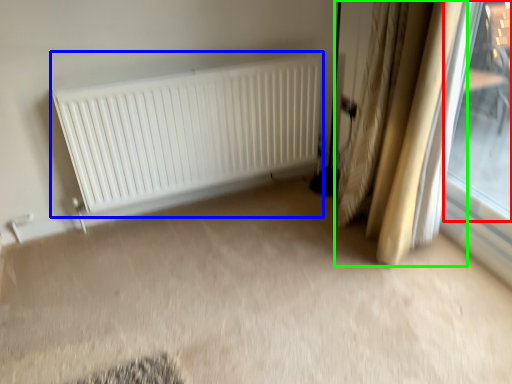
Question: Estimate the real-world distances between objects in this image. Which object is farther from window (highlighted by a red box), radiator (highlighted by a blue box) or curtain (highlighted by a green box)?

Choices:
 (A) radiator
 (B) curtain

Answer: (A)